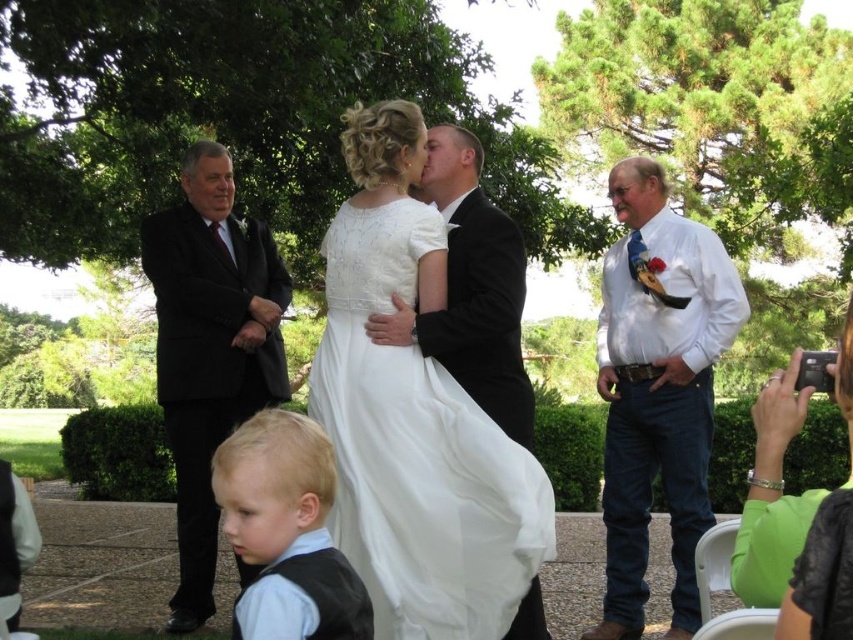
Consider the image. You are a photographer at a wedding and need to position the black suit at left and the green fabric flower girl at lower right in your shot. Which object should you adjust to ensure both are in frame? Explain your reasoning.

The black suit at left is taller than the green fabric flower girl at lower right. To ensure both are in frame, adjust the camera angle or zoom so that the taller black suit at left fits within the shot while still including the shorter green fabric flower girl at lower right.

You are standing at the center of the wedding garden and want to hand a bouquet to the black suit at left and the green fabric flower girl at lower right. Which one is closer to you?

The black suit at left is 4.22 meters from the green fabric flower girl at lower right. Therefore, the distance from you to each of them depends on your current position. Without knowing your exact location, it is impossible to determine who is closer.